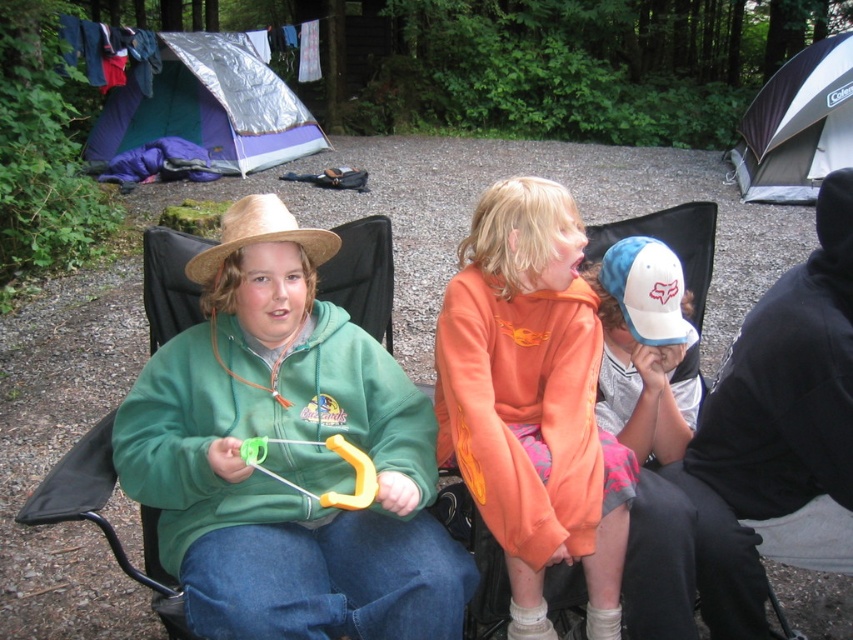
Is orange fleece sweatshirt at center positioned behind black and white canvas tent at upper right?

No, orange fleece sweatshirt at center is in front of black and white canvas tent at upper right.

Who is more distant from viewer, (602, 456) or (824, 120)?

The point (824, 120) is more distant.

The image size is (853, 640). What are the coordinates of `orange fleece sweatshirt at center` in the screenshot? It's located at (532, 403).

Locate an element on the screen. The height and width of the screenshot is (640, 853). orange fleece sweatshirt at center is located at coordinates (532, 403).

Who is higher up, blue tarp tent at upper left or black and white canvas tent at upper right?

blue tarp tent at upper left is higher up.

Is point (218, 109) closer to viewer compared to point (848, 93)?

No, (218, 109) is behind (848, 93).

Find the location of `blue tarp tent at upper left`. blue tarp tent at upper left is located at coordinates (207, 108).

Where is `blue tarp tent at upper left`? Image resolution: width=853 pixels, height=640 pixels. blue tarp tent at upper left is located at coordinates (207, 108).

Is green fleece hoodie at center to the left of black and white canvas tent at upper right from the viewer's perspective?

Correct, you'll find green fleece hoodie at center to the left of black and white canvas tent at upper right.

How much distance is there between green fleece hoodie at center and black and white canvas tent at upper right?

green fleece hoodie at center is 7.87 meters from black and white canvas tent at upper right.

Who is more forward, (340, 547) or (799, 154)?

Positioned in front is point (340, 547).

Where is `green fleece hoodie at center`? This screenshot has width=853, height=640. green fleece hoodie at center is located at coordinates (287, 438).